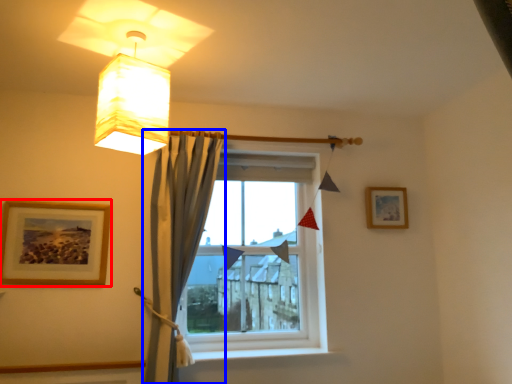
Question: Which point is further to the camera, picture frame (highlighted by a red box) or curtain (highlighted by a blue box)?

Choices:
 (A) picture frame
 (B) curtain

Answer: (A)